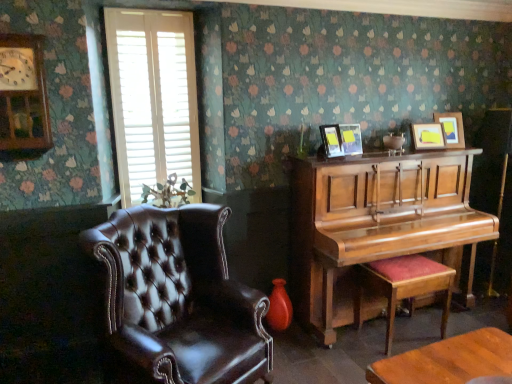
You are a GUI agent. You are given a task and a screenshot of the screen. Output one action in this format:
    pyautogui.click(x=<x>, y=<y>)
    Task: Click on the vacant space in matte gold picture frame at upper right, which appears as the 3th picture frame when viewed from the right (from a real-world perspective)
    The width and height of the screenshot is (512, 384).
    Given the screenshot: What is the action you would take?
    pyautogui.click(x=350, y=156)